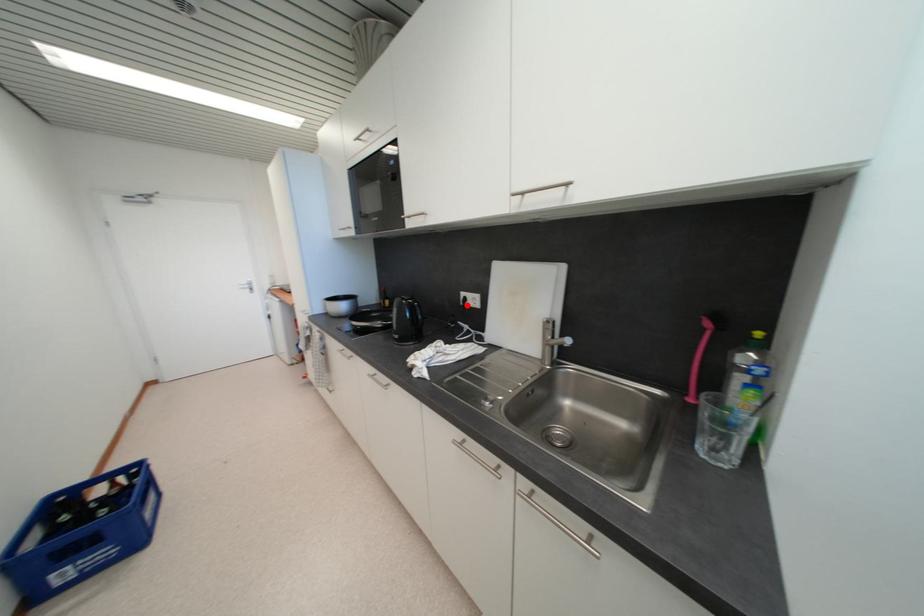
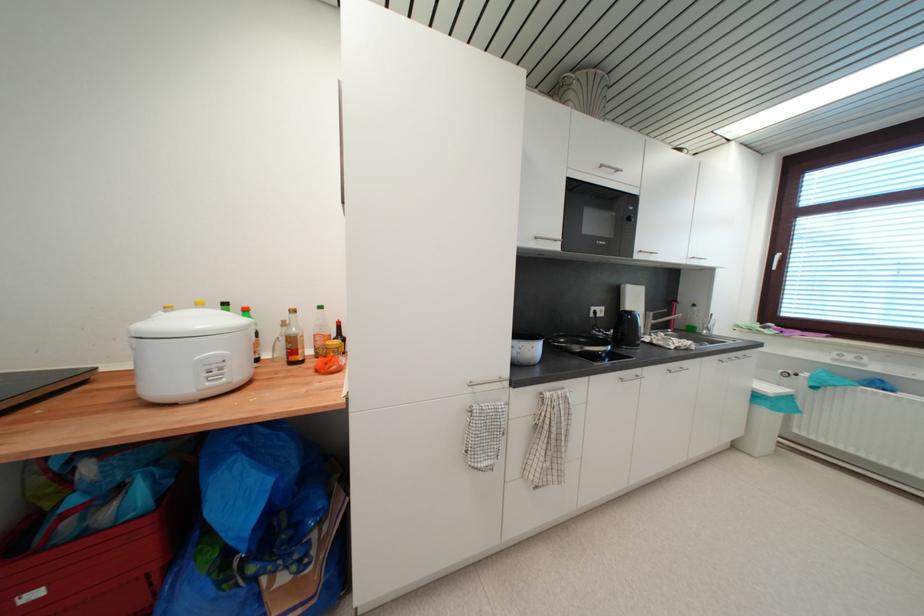
Question: I am providing you with two images of the same scene from different viewpoints. A red point is marked on the first image. At the location where the point appears in image 1, is it still visible in image 2?

Choices:
 (A) Yes
 (B) No

Answer: (A)